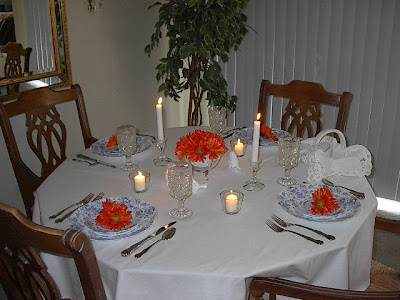
Locate an element on the screen. This screenshot has height=300, width=400. candles is located at coordinates (143, 175), (159, 111), (226, 202), (240, 146), (256, 123).